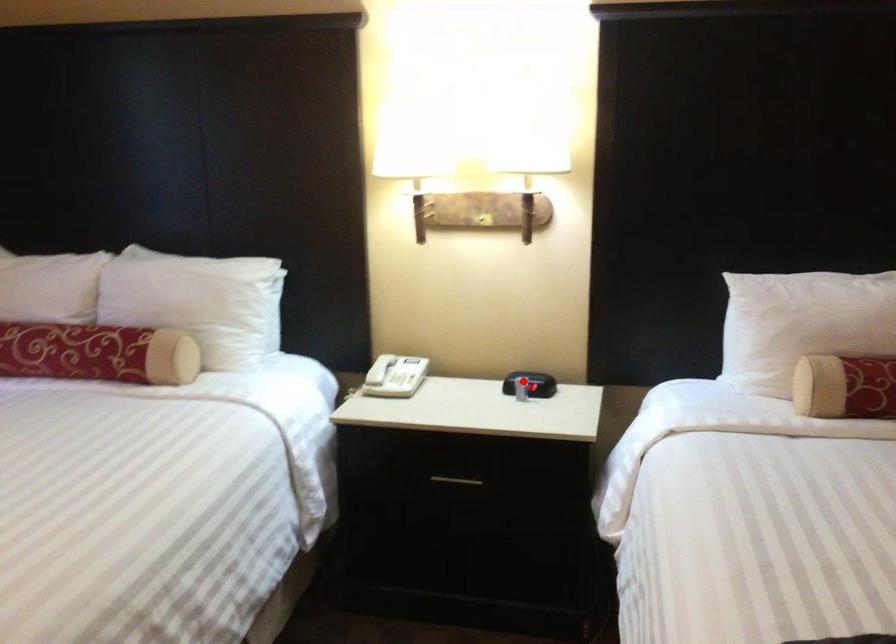
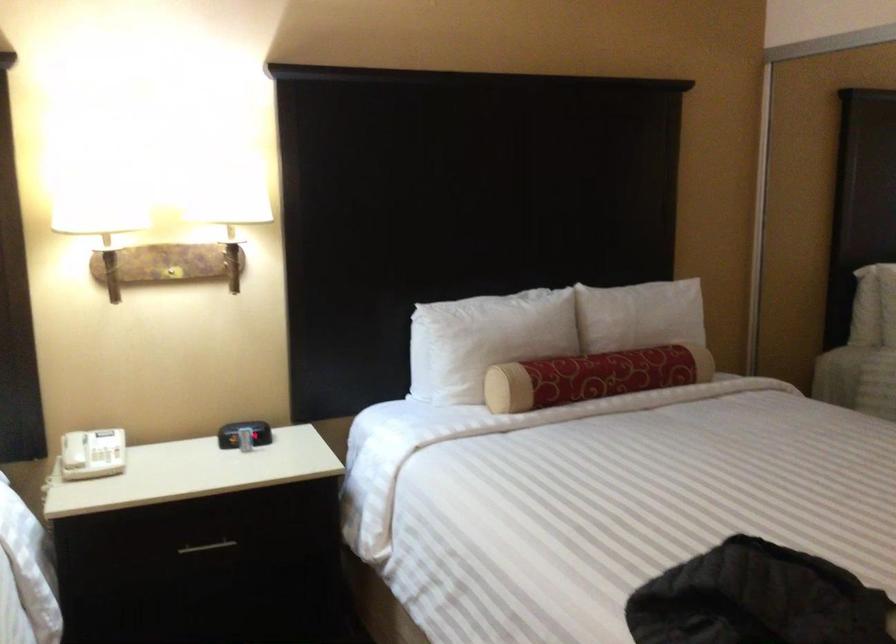
In the second image, find the point that corresponds to the highlighted location in the first image.

(244, 433)